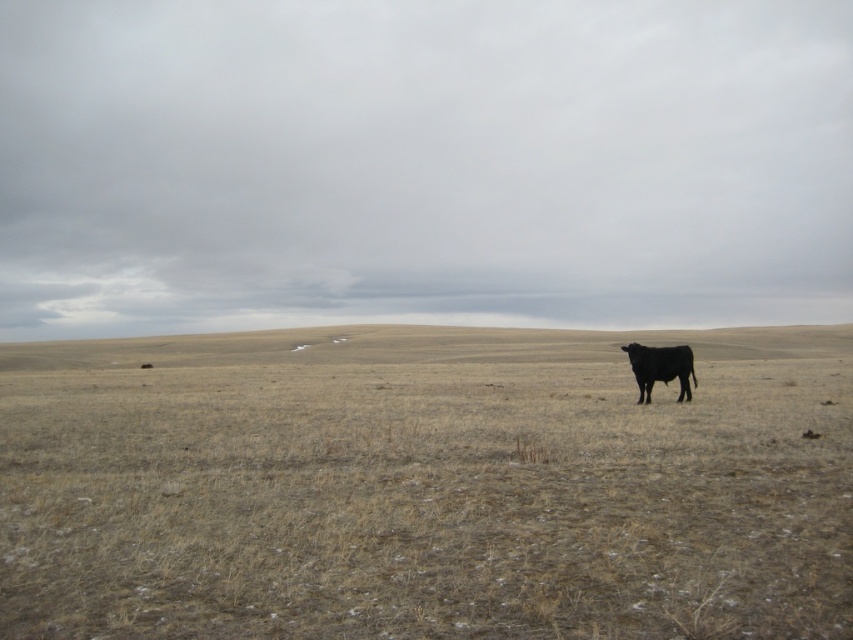
Question: Can you confirm if brown grassland at center is thinner than black smooth bull at right?

Choices:
 (A) no
 (B) yes

Answer: (A)

Question: Does brown grassland at center appear on the left side of black smooth bull at right?

Choices:
 (A) no
 (B) yes

Answer: (A)

Question: Can you confirm if brown grassland at center is positioned above black smooth bull at right?

Choices:
 (A) no
 (B) yes

Answer: (A)

Question: Which object is closer to the camera taking this photo?

Choices:
 (A) brown grassland at center
 (B) black smooth bull at right

Answer: (A)

Question: Which point is farther to the camera?

Choices:
 (A) brown grassland at center
 (B) black smooth bull at right

Answer: (B)